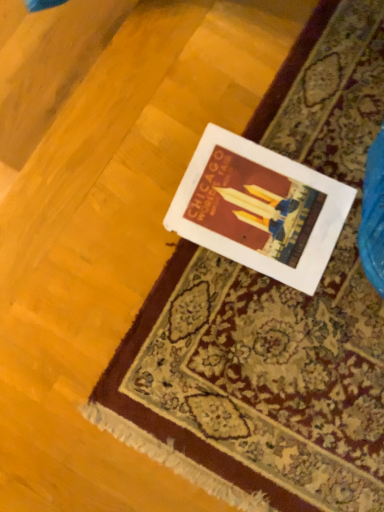
Where is `vacant point to the right of matte paper book at center`? This screenshot has height=512, width=384. vacant point to the right of matte paper book at center is located at coordinates (339, 310).